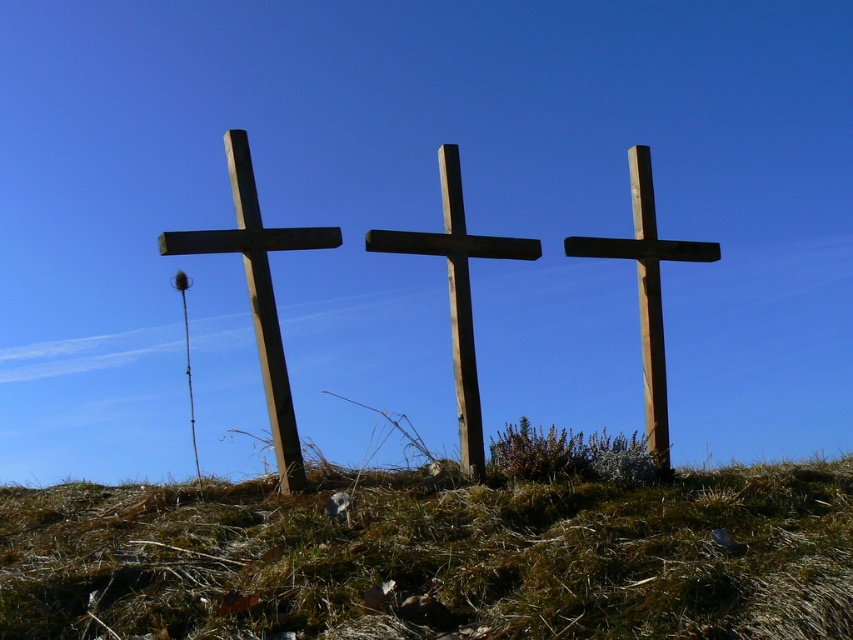
Question: Which of the following is the farthest from the observer?

Choices:
 (A) (167, 252)
 (B) (572, 246)
 (C) (747, 476)

Answer: (B)

Question: Among these objects, which one is nearest to the camera?

Choices:
 (A) smooth brown wooden cross at right
 (B) wooden cross at center
 (C) green grassy at center
 (D) wooden cross at left

Answer: (C)

Question: Is wooden cross at left behind smooth brown wooden cross at right?

Choices:
 (A) yes
 (B) no

Answer: (B)

Question: Does green grassy at center have a lesser width compared to smooth brown wooden cross at right?

Choices:
 (A) no
 (B) yes

Answer: (A)

Question: Which point appears farthest from the camera in this image?

Choices:
 (A) (422, 516)
 (B) (589, 244)

Answer: (B)

Question: Is wooden cross at left above smooth brown wooden cross at right?

Choices:
 (A) yes
 (B) no

Answer: (B)